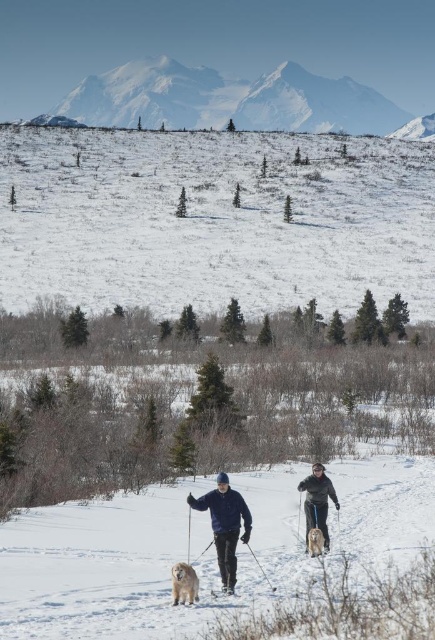
Question: Does dark blue fleece jacket at center have a smaller size compared to golden fur dog at lower center?

Choices:
 (A) no
 (B) yes

Answer: (A)

Question: Is snowy mountain range at upper center wider than dark blue fleece jacket at center?

Choices:
 (A) yes
 (B) no

Answer: (A)

Question: Considering the relative positions of white powdery snow at upper center and snowy mountain range at upper center in the image provided, where is white powdery snow at upper center located with respect to snowy mountain range at upper center?

Choices:
 (A) left
 (B) right

Answer: (B)

Question: Which object is positioned closest to the dark blue fleece jacket at center?

Choices:
 (A) snowy mountain range at upper center
 (B) white powdery snow at upper center
 (C) golden fur dog at center
 (D) gray fleece jacket at center

Answer: (C)

Question: Which object appears farthest from the camera in this image?

Choices:
 (A) golden fur dog at center
 (B) golden fur dog at lower center
 (C) white powdery snow at upper center
 (D) blue fleece jacket at center

Answer: (C)

Question: Which point appears closest to the camera in this image?

Choices:
 (A) (247, 515)
 (B) (233, 589)
 (C) (317, 493)

Answer: (A)